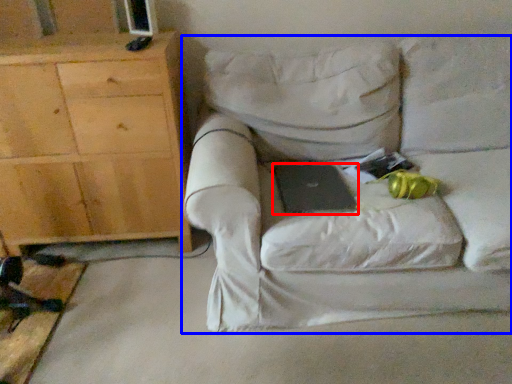
Question: Which object is closer to the camera taking this photo, laptop (highlighted by a red box) or chair (highlighted by a blue box)?

Choices:
 (A) laptop
 (B) chair

Answer: (B)